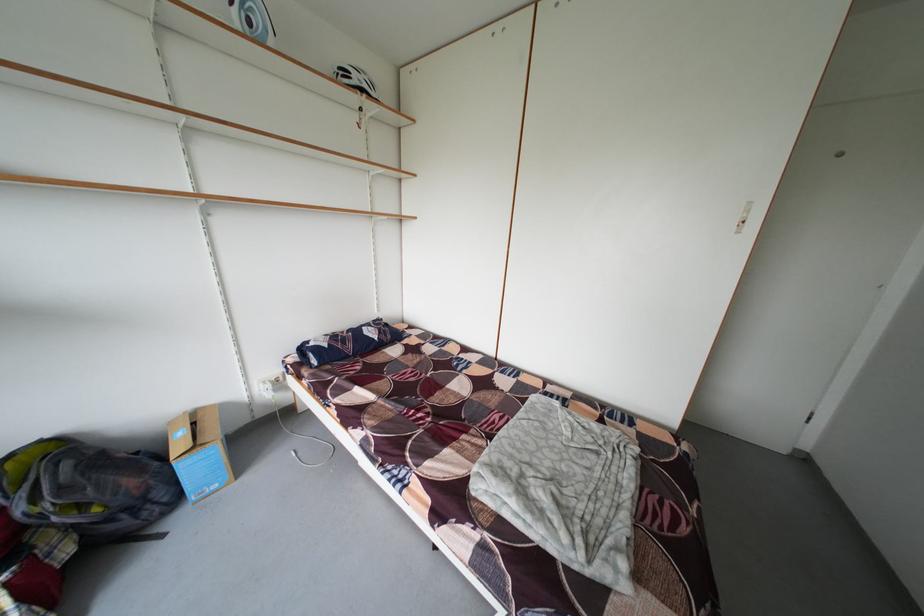
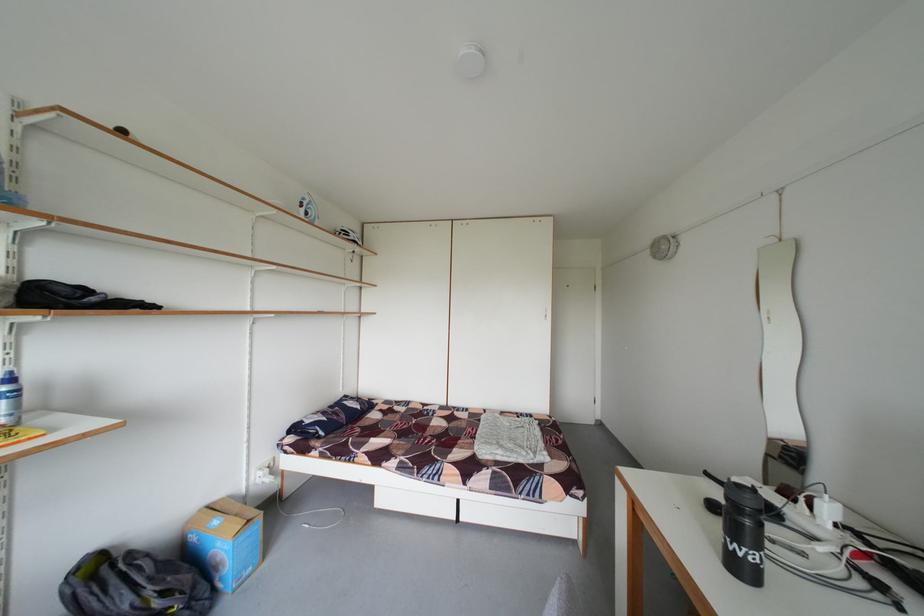
Find the pixel in the second image that matches point 224,411 in the first image.

(233, 505)